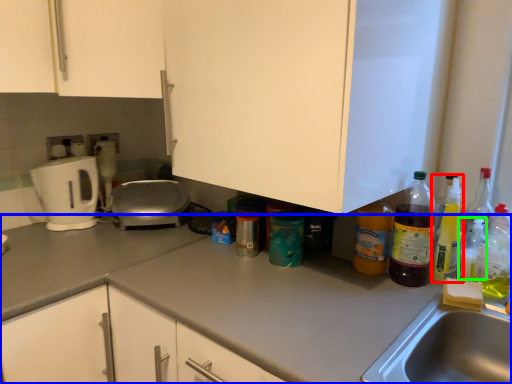
Question: Considering the real-world distances, which object is farthest from bottle (highlighted by a red box)? countertop (highlighted by a blue box) or bottle (highlighted by a green box)?

Choices:
 (A) countertop
 (B) bottle

Answer: (A)